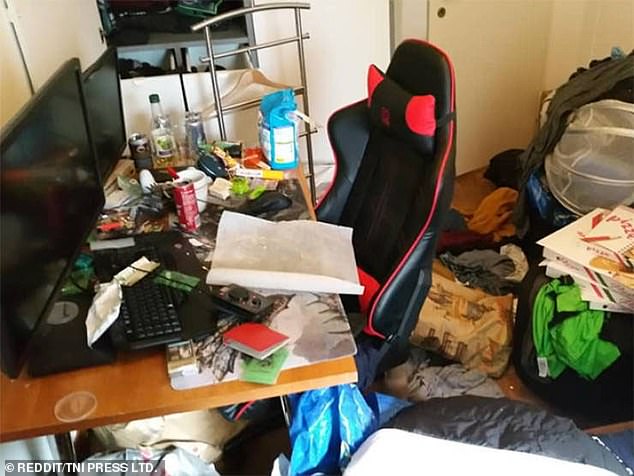
What are the coordinates of `mouse` in the screenshot? It's located at (269, 197).